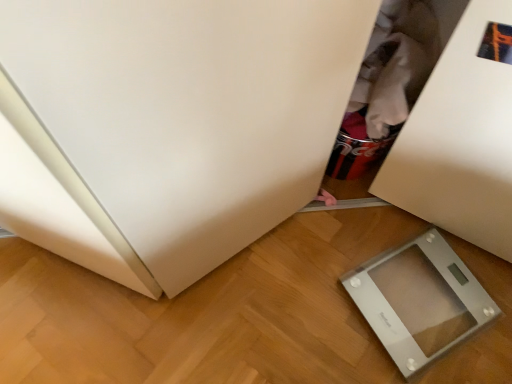
Identify the location of vacant region under transparent glass scale at lower right (from a real-world perspective). The height and width of the screenshot is (384, 512). (421, 299).